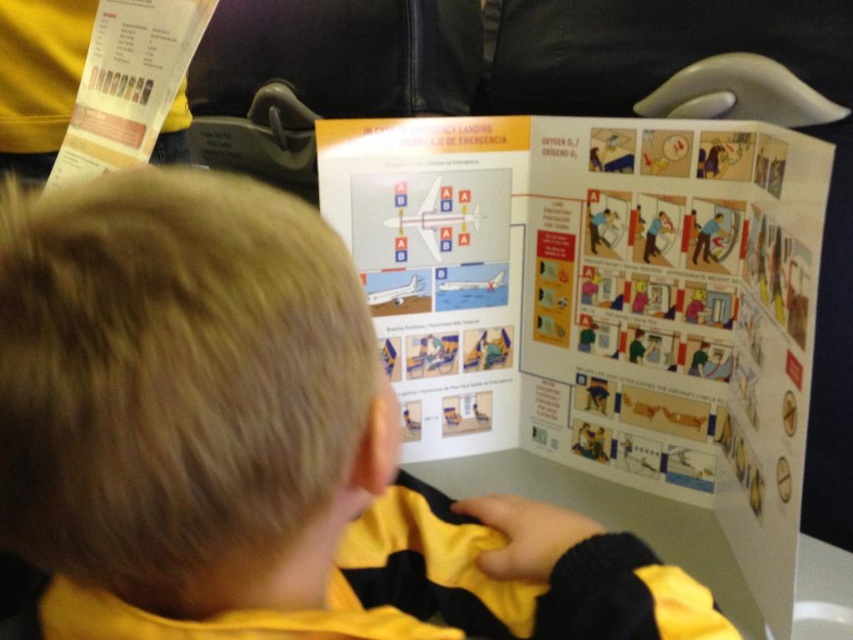
You are a flight attendant preparing to distribute safety instructions to passengers. You have two white papers, one at center and one at upper left. The distance between them is crucial for ensuring passengers can easily reach both. Can you confirm if the distance between the white paper at center and the white paper at upper left is within the recommended 16 inches for comfortable passenger access?

The white paper at center is 15.23 inches away from the white paper at upper left, which is within the recommended 16 inches for comfortable passenger access.

You are a flight attendant and need to check if the yellow fabric shirt at upper center and the white paper at center can be seen by passengers sitting in the middle of the plane. Which object is more likely to be visible to them?

The white paper at center is taller than the yellow fabric shirt at upper center, so it is more likely to be visible to passengers sitting in the middle of the plane.

You are a flight attendant preparing to distribute safety instructions. You have a limited space on the airplane seatback pocket. The yellow fabric shirt at upper center and the white paper at upper left need to be placed there. Which item should you choose to ensure it fits better in the narrow space?

The white paper at upper left should be chosen because its width is narrower than the yellow fabric shirt at upper center, making it more likely to fit in the narrow seatback pocket.